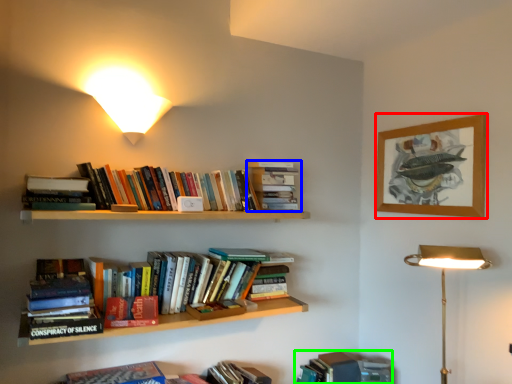
Question: Which object is positioned closest to picture frame (highlighted by a red box)? Select from book (highlighted by a blue box) and book (highlighted by a green box).

Choices:
 (A) book
 (B) book

Answer: (A)